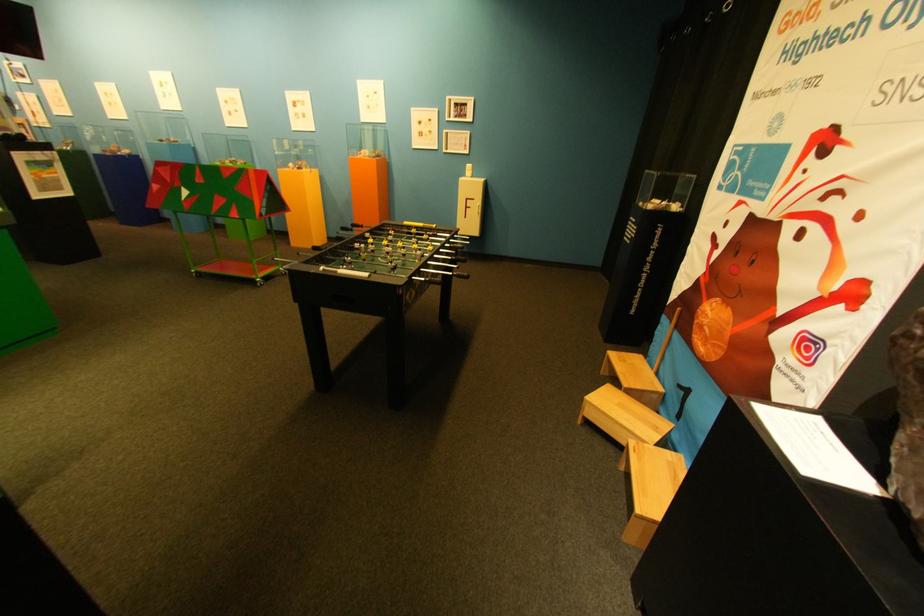
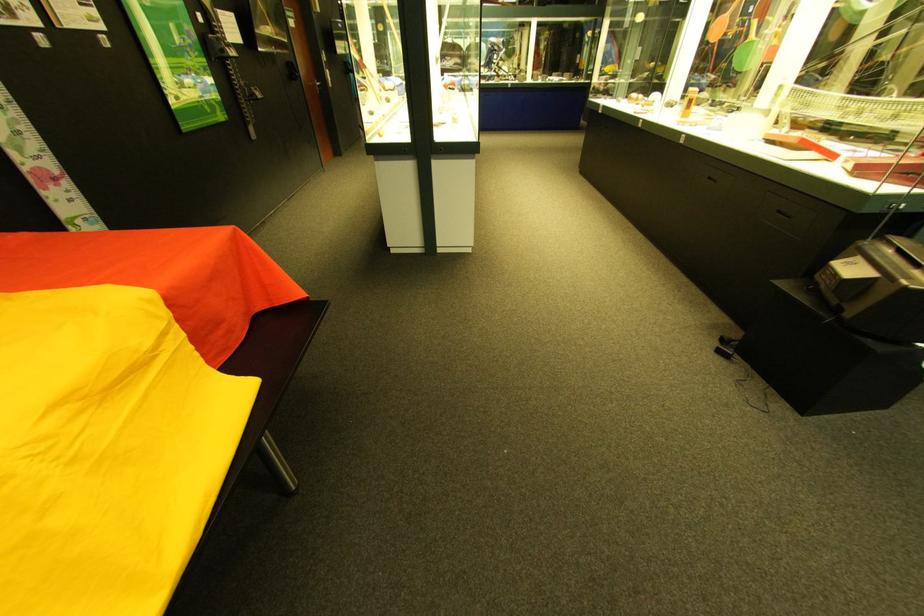
Question: I am providing you with two images of the same scene from different viewpoints. Which of the following objects are not visible in image2?

Choices:
 (A) silver door handle
 (B) wheeled display cart
 (C) blue VR headset
 (D) black drawer pull

Answer: (B)